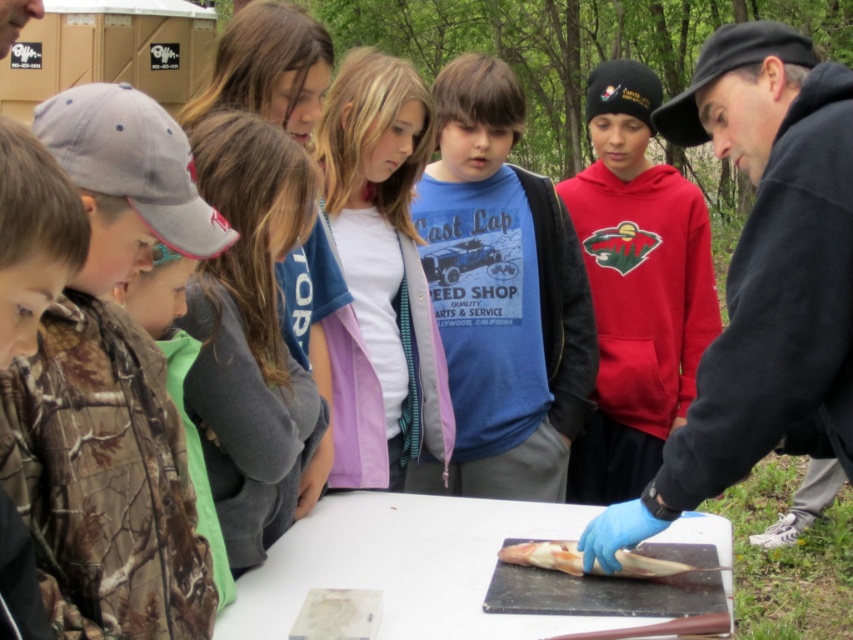
What is the position of the pink fabric jacket at center relative to the fish on the black cutting board?

The pink fabric jacket at center is located at point (x=380, y=275).

Looking at this image, you are a photographer standing at the edge of the group. You want to take a photo that includes both the pink fabric jacket at center and the pinkish translucent fish at center. What is the minimum distance you need to move backward to ensure both are in frame?

The pink fabric jacket at center and the pinkish translucent fish at center are 37.79 inches apart. To include both in the photo, you need to move backward at least 37.79 inches so that the camera can capture the entire distance between them.